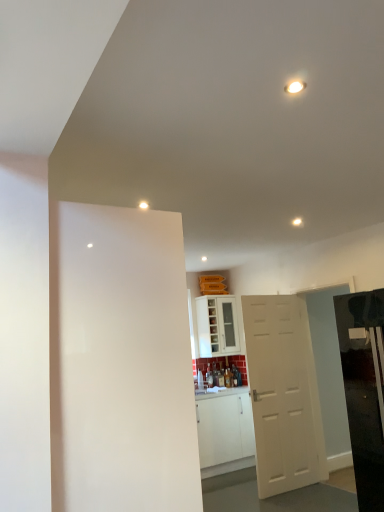
Question: Can you confirm if glossy black refrigerator at right is shorter than white matte door at center, arranged as the second door when viewed from the left?

Choices:
 (A) no
 (B) yes

Answer: (B)

Question: Is glossy black refrigerator at right thinner than white matte door at center, the second door positioned from the front?

Choices:
 (A) yes
 (B) no

Answer: (B)

Question: From a real-world perspective, is glossy black refrigerator at right located higher than white matte door at center, arranged as the 1th door when viewed from the right?

Choices:
 (A) yes
 (B) no

Answer: (A)

Question: Is glossy black refrigerator at right outside of white matte door at center, positioned as the 1th door in back-to-front order?

Choices:
 (A) yes
 (B) no

Answer: (A)

Question: From the image's perspective, is glossy black refrigerator at right located above white matte door at center, arranged as the 1th door when viewed from the right?

Choices:
 (A) no
 (B) yes

Answer: (B)

Question: From a real-world perspective, does glossy black refrigerator at right sit lower than white matte door at center, arranged as the 1th door when viewed from the right?

Choices:
 (A) no
 (B) yes

Answer: (A)

Question: Can you confirm if white matte door at center, positioned as the 1th door in back-to-front order, is smaller than white glossy cabinet at center?

Choices:
 (A) yes
 (B) no

Answer: (B)

Question: Is white matte door at center, arranged as the second door when viewed from the left, facing towards white glossy cabinet at center?

Choices:
 (A) no
 (B) yes

Answer: (A)

Question: Is white matte door at center, arranged as the 1th door when viewed from the right, further to camera compared to white glossy cabinet at center?

Choices:
 (A) no
 (B) yes

Answer: (A)

Question: From a real-world perspective, is white matte door at center, arranged as the second door when viewed from the left, under white glossy cabinet at center?

Choices:
 (A) yes
 (B) no

Answer: (A)

Question: From the image's perspective, is white matte door at center, arranged as the 1th door when viewed from the right, located above white glossy cabinet at center?

Choices:
 (A) no
 (B) yes

Answer: (A)

Question: Can you confirm if white matte door at center, arranged as the second door when viewed from the left, is wider than white glossy cabinet at center?

Choices:
 (A) yes
 (B) no

Answer: (B)

Question: Is white glossy light at upper center placed right next to glossy black refrigerator at right?

Choices:
 (A) no
 (B) yes

Answer: (A)